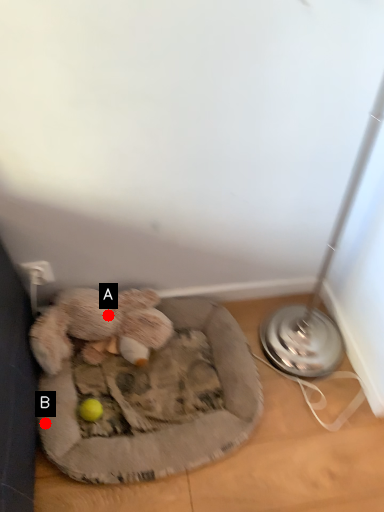
Question: Two points are circled on the image, labeled by A and B beside each circle. Which point is closer to the camera?

Choices:
 (A) A is closer
 (B) B is closer

Answer: (B)